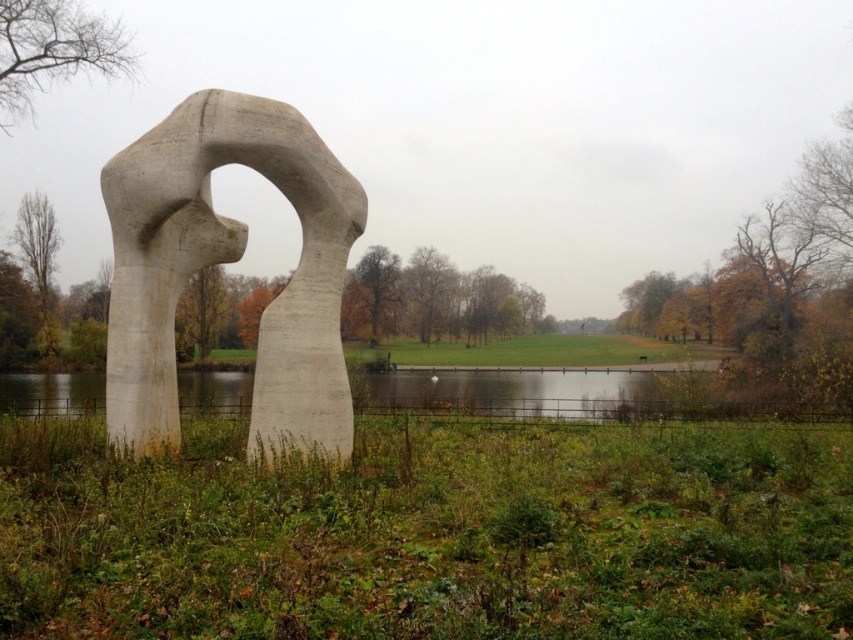
Question: Is white concrete sculpture at center below transparent water at center?

Choices:
 (A) no
 (B) yes

Answer: (A)

Question: Observing the image, what is the correct spatial positioning of white concrete sculpture at center in reference to transparent water at center?

Choices:
 (A) above
 (B) below

Answer: (A)

Question: Which point is farther from the camera taking this photo?

Choices:
 (A) (338, 348)
 (B) (601, 388)

Answer: (B)

Question: Can you confirm if white concrete sculpture at center is positioned to the left of transparent water at center?

Choices:
 (A) no
 (B) yes

Answer: (A)

Question: Which object appears farthest from the camera in this image?

Choices:
 (A) transparent water at center
 (B) white concrete sculpture at center

Answer: (A)